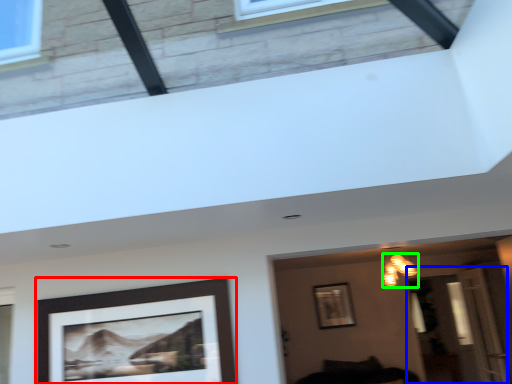
Question: Estimate the real-world distances between objects in this image. Which object is closer to picture frame (highlighted by a red box), glass door (highlighted by a blue box) or light fixture (highlighted by a green box)?

Choices:
 (A) glass door
 (B) light fixture

Answer: (B)